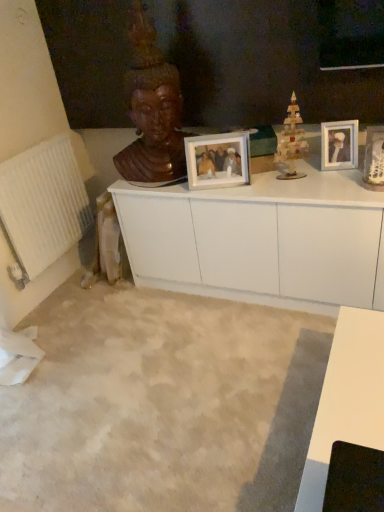
Identify the location of vacant area that is in front of wooden toy at center. Image resolution: width=384 pixels, height=512 pixels. (306, 187).